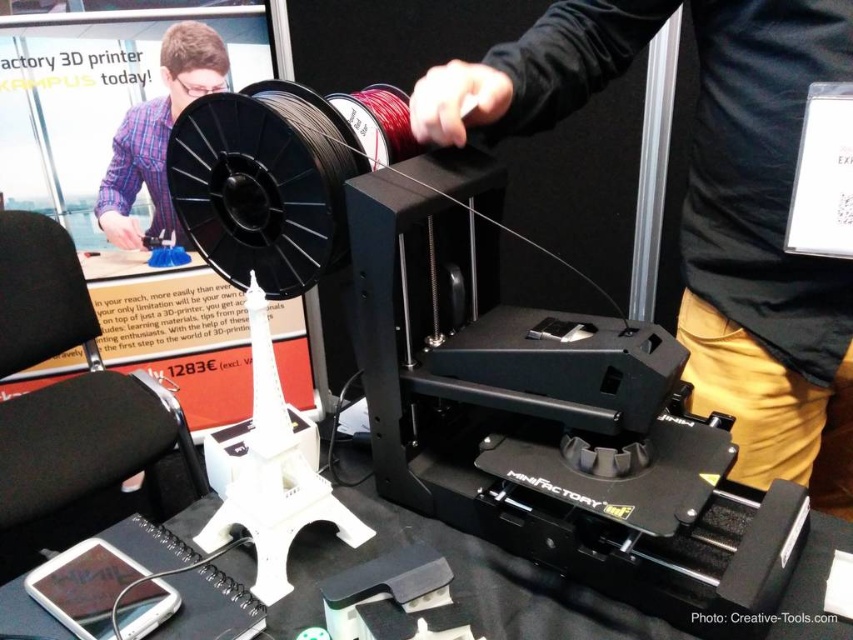
Question: Considering the real-world distances, which object is closest to the white plastic eiffel tower at lower center?

Choices:
 (A) matte black shirt at upper center
 (B) black matte 3d printer at center
 (C) black matte table at center

Answer: (C)

Question: Can you confirm if black matte table at center is thinner than matte black shirt at upper center?

Choices:
 (A) yes
 (B) no

Answer: (B)

Question: Which point is closer to the camera taking this photo?

Choices:
 (A) (544, 83)
 (B) (260, 566)
 (C) (680, 634)

Answer: (C)

Question: Is black matte 3d printer at center bigger than matte black shirt at upper center?

Choices:
 (A) no
 (B) yes

Answer: (B)

Question: Which object is closer to the camera taking this photo?

Choices:
 (A) matte black shirt at upper center
 (B) black matte table at center
 (C) white plastic eiffel tower at lower center
 (D) black matte 3d printer at center

Answer: (C)

Question: Is black matte table at center thinner than matte black shirt at upper center?

Choices:
 (A) yes
 (B) no

Answer: (B)